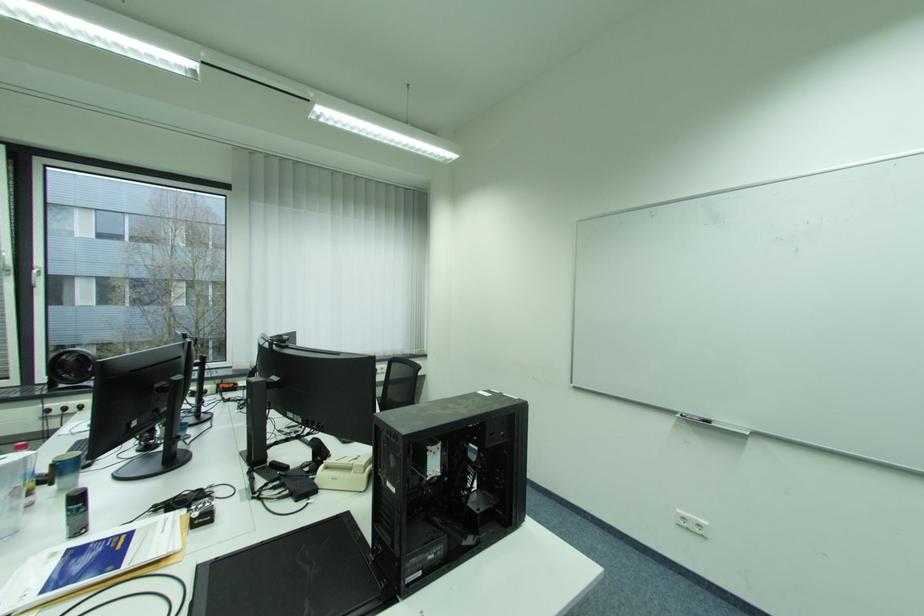
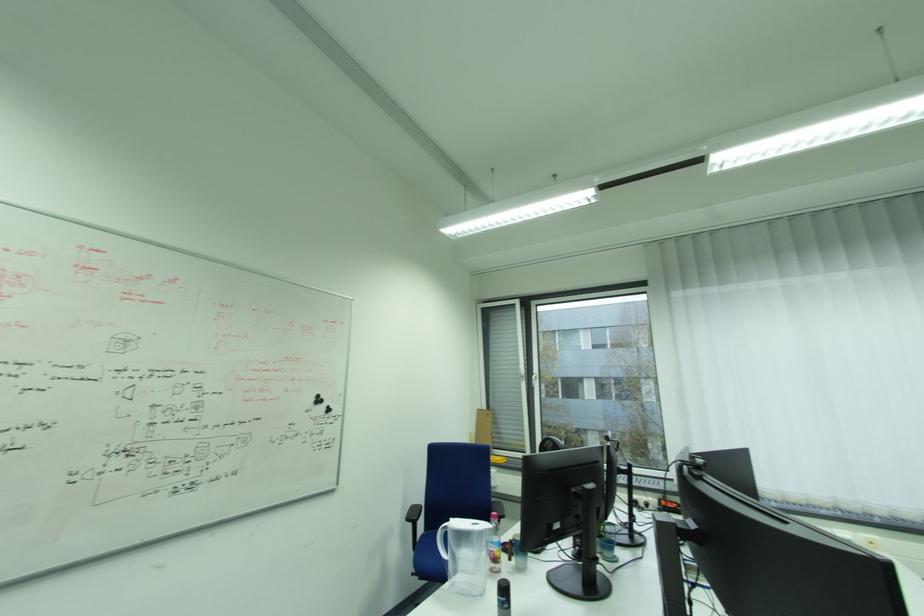
Question: The first image is from the beginning of the video and the second image is from the end. How did the camera likely rotate when shooting the video?

Choices:
 (A) Left
 (B) Right
 (C) Up
 (D) Down

Answer: (A)